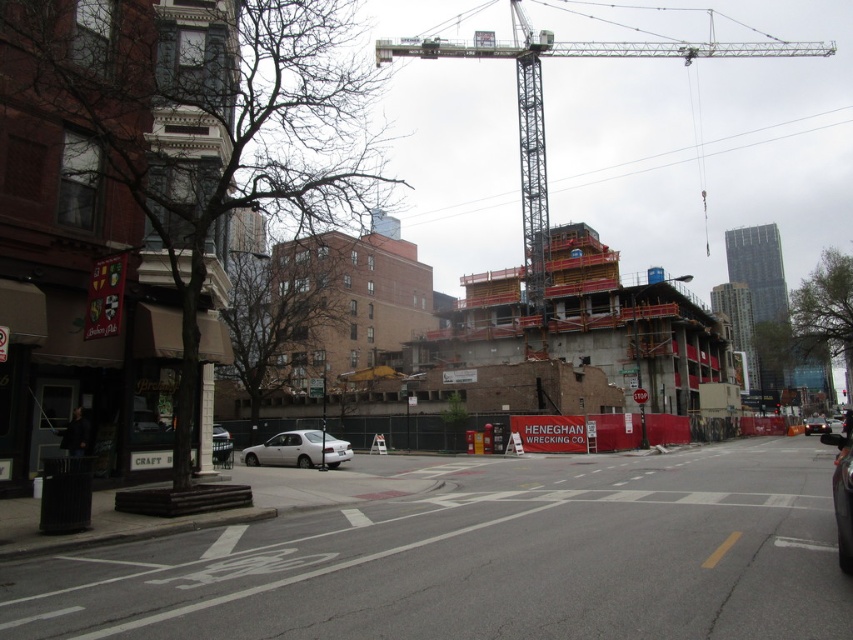
You are a city planner evaluating the safety of the construction site. Given the distance between the smooth asphalt road at center and the metallic gray crane at upper center, would a standard delivery truck measuring 15 meters in length be able to pass safely between them without any obstruction?

The distance between the smooth asphalt road at center and the metallic gray crane at upper center is 123.41 meters, which is significantly larger than the 15 meter length of the delivery truck. Therefore, the truck can pass safely between them without any obstruction.

You are a delivery driver who needs to park your vehicle on the smooth asphalt road at center. The construction site has a metallic gray crane at upper center. Is there enough space between the crane and the road for your vehicle to maneuver safely?

The smooth asphalt road at center is located below the metallic gray crane at upper center, so there should be sufficient vertical clearance for your vehicle to maneuver safely between them.

In the scene shown: You are a delivery person driving a delivery van that is 2 meters wide. You need to drive through the area shown in the image. Is there enough space between the smooth asphalt road at center and the shiny black sedan at center for your van to pass through?

The smooth asphalt road at center is positioned over the shiny black sedan at center, which means there is no space between them. Therefore, the delivery van cannot pass through that area.